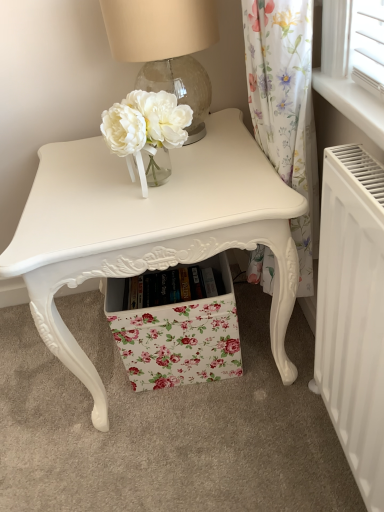
This screenshot has height=512, width=384. I want to click on vacant area that is in front of floral fabric drawer at center, so click(x=200, y=433).